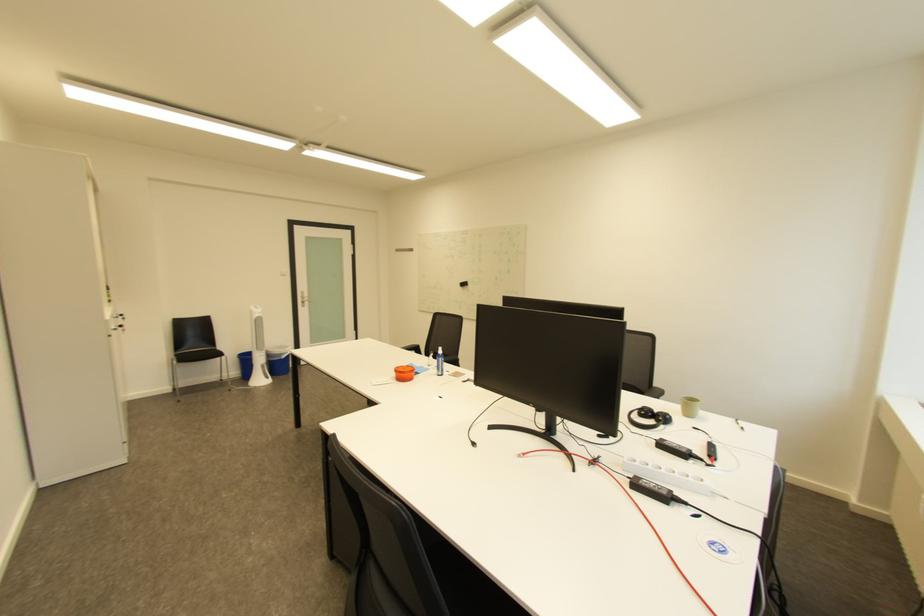
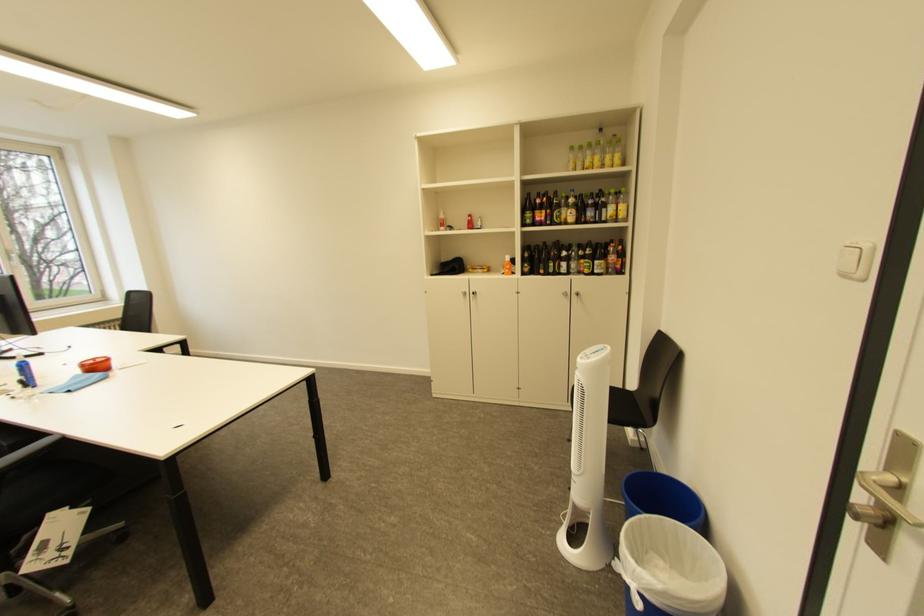
Locate, in the second image, the point that corresponds to (x=297, y=353) in the first image.

(636, 570)